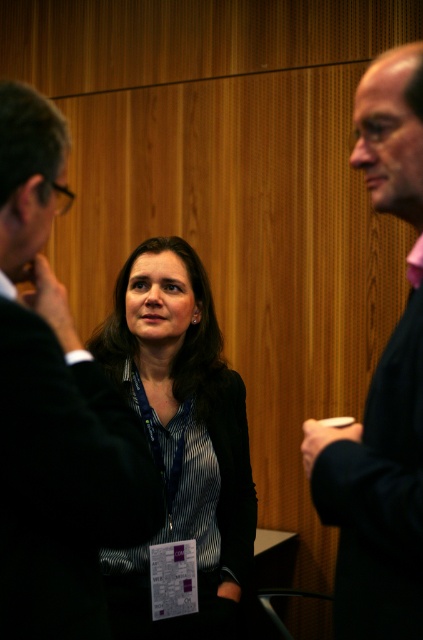
Question: Is matte black blazer at center below pink fabric shirt at right?

Choices:
 (A) yes
 (B) no

Answer: (A)

Question: Is matte black suit at left positioned behind matte black blazer at center?

Choices:
 (A) yes
 (B) no

Answer: (B)

Question: Does matte black blazer at center have a smaller size compared to pink fabric shirt at right?

Choices:
 (A) no
 (B) yes

Answer: (A)

Question: Estimate the real-world distances between objects in this image. Which object is closer to the matte black suit at left?

Choices:
 (A) pink fabric shirt at right
 (B) matte black blazer at center

Answer: (A)

Question: Which point is farther from the camera taking this photo?

Choices:
 (A) (90, 614)
 (B) (420, 179)
 (C) (195, 627)

Answer: (C)

Question: Which point is farther from the camera taking this photo?

Choices:
 (A) (206, 323)
 (B) (51, 508)
 (C) (354, 584)

Answer: (A)